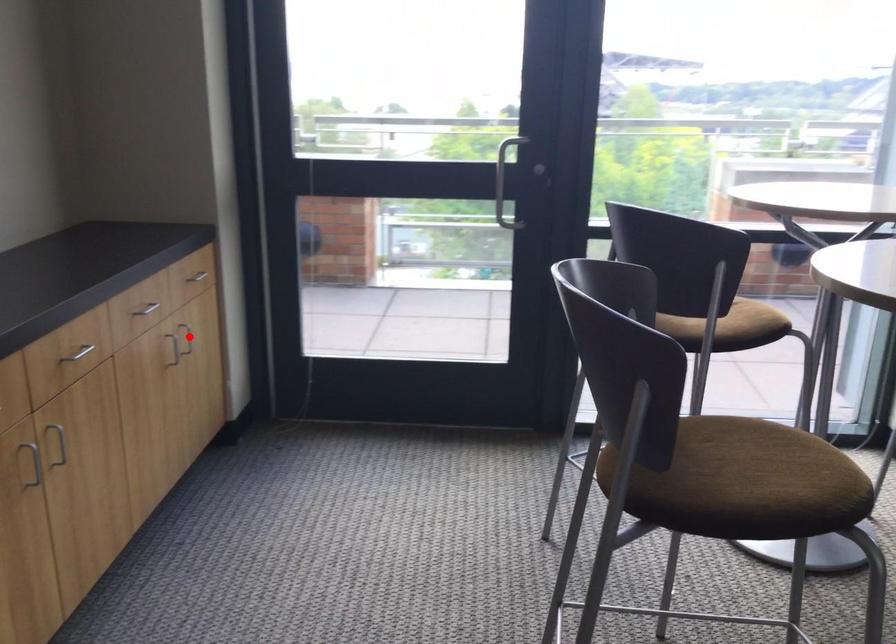
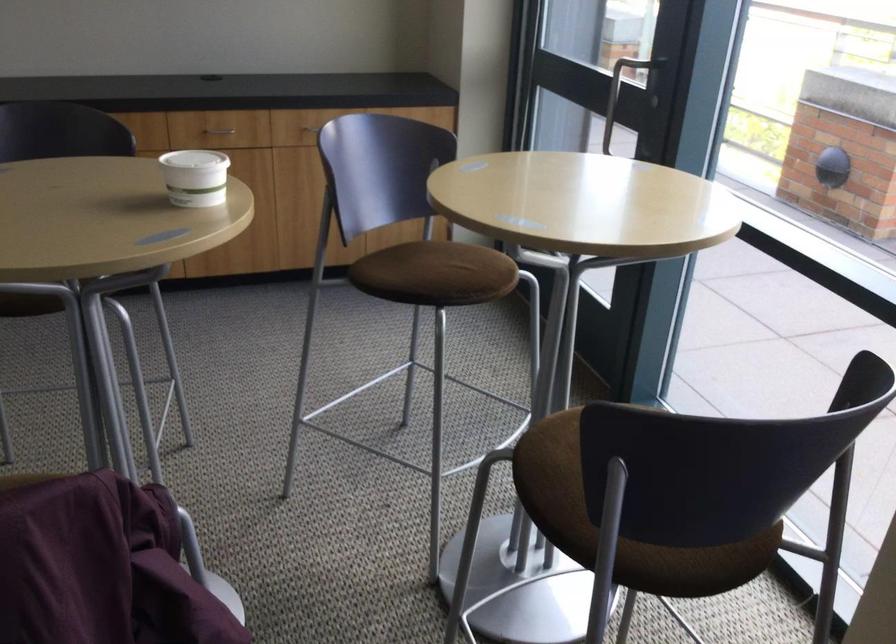
Question: I am providing you with two images of the same scene from different viewpoints. A red point is marked on the first image. At the location where the point appears in image 1, is it still visible in image 2?

Choices:
 (A) Yes
 (B) No

Answer: (B)